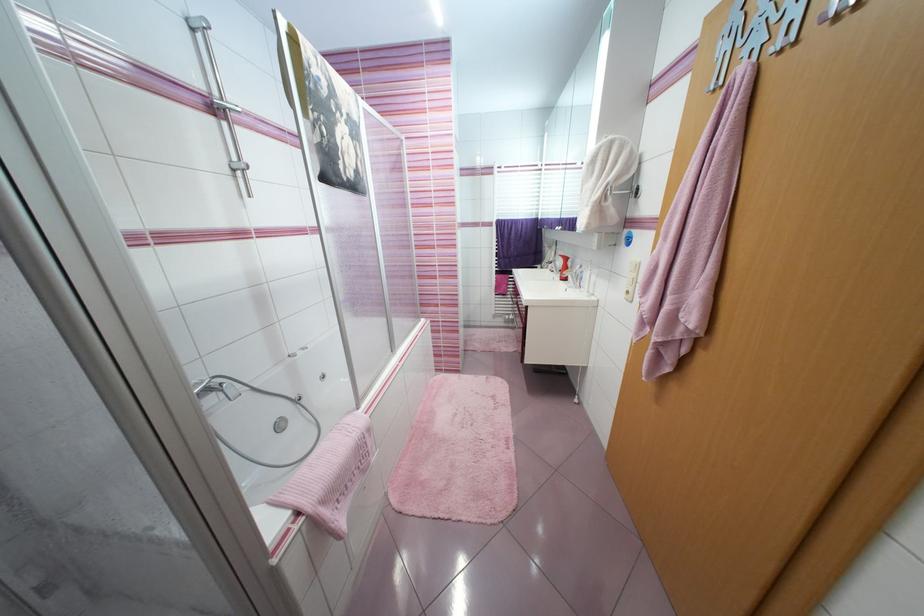
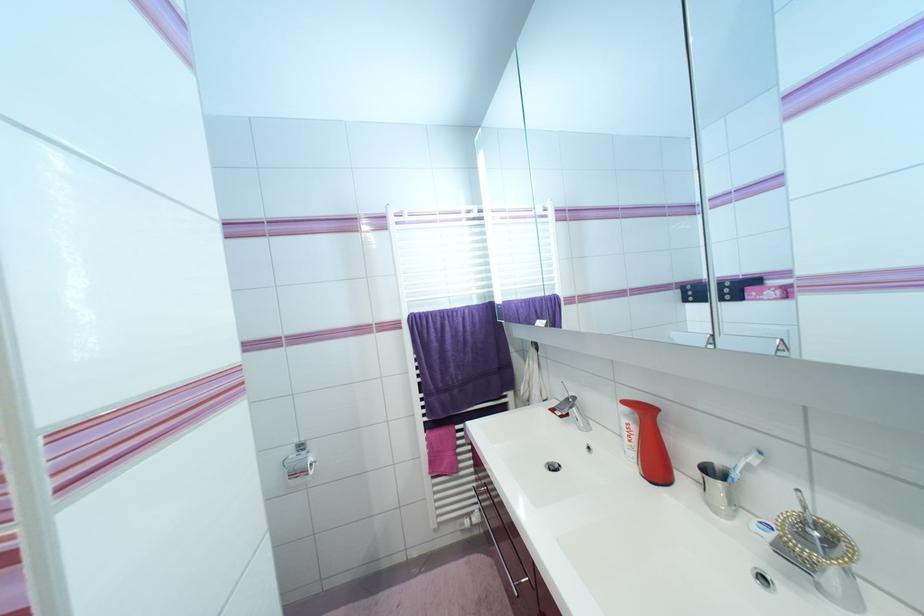
Question: In a continuous first-person perspective shot, in which direction is the camera moving?

Choices:
 (A) Left
 (B) Right
 (C) Forward
 (D) Backward

Answer: (C)